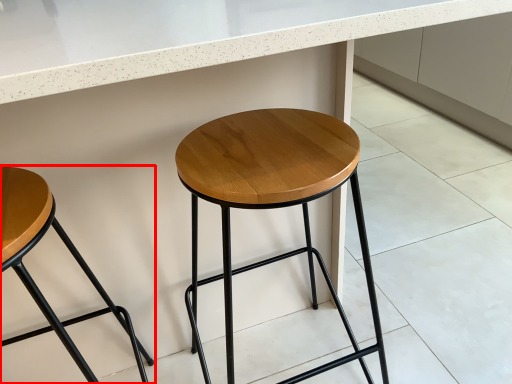
Question: From the image's perspective, what is the correct spatial relationship of stool (annotated by the red box) in relation to stool?

Choices:
 (A) below
 (B) above

Answer: (A)